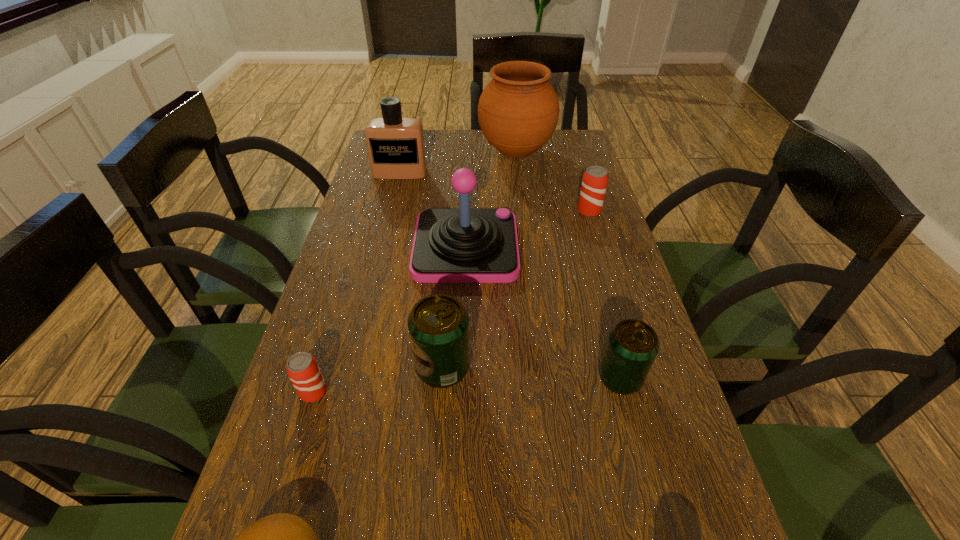
Where is `pottery`? The width and height of the screenshot is (960, 540). pottery is located at coordinates (518, 111).

At what (x,y) coordinates should I click in order to perform the action: click on beige perfume. Please return your answer as a coordinate pair (x, y). Looking at the image, I should click on (395, 144).

At what (x,y) coordinates should I click in order to perform the action: click on joystick. Please return your answer as a coordinate pair (x, y). Looking at the image, I should click on (464, 245).

At what (x,y) coordinates should I click in order to perform the action: click on the bigger green beer can. Please return your answer as a coordinate pair (x, y). Looking at the image, I should click on (438, 324).

Locate an element on the screen. Image resolution: width=960 pixels, height=540 pixels. the tallest beer can is located at coordinates (438, 324).

This screenshot has width=960, height=540. In order to click on the farthest beer can in this screenshot , I will do `click(595, 178)`.

Locate an element on the screen. the bigger orange beer can is located at coordinates (595, 178).

I want to click on the right green beer can, so click(632, 345).

The image size is (960, 540). I want to click on the nearer orange beer can, so tap(302, 368).

The width and height of the screenshot is (960, 540). What are the coordinates of `the leftmost beer can` in the screenshot? It's located at tap(302, 368).